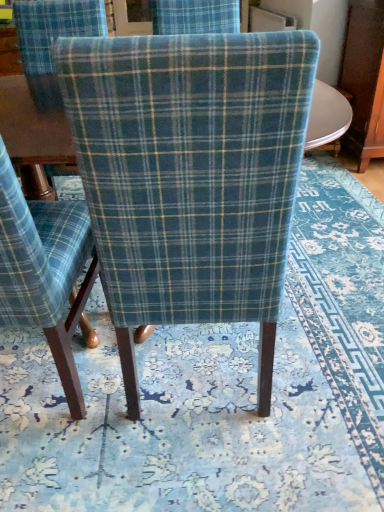
Question: From a real-world perspective, relative to blue floral rug at center, is blue plaid fabric chair at center, marked as the 1th chair in a left-to-right arrangement, vertically above or below?

Choices:
 (A) above
 (B) below

Answer: (A)

Question: Looking at their shapes, would you say blue plaid fabric chair at center, marked as the 1th chair in a left-to-right arrangement, is wider or thinner than blue floral rug at center?

Choices:
 (A) thin
 (B) wide

Answer: (A)

Question: Estimate the real-world distances between objects in this image. Which object is closer to the blue plaid fabric chair at center, the second chair when ordered from right to left?

Choices:
 (A) plaid fabric chair at center, acting as the 2th chair starting from the left
 (B) blue floral rug at center

Answer: (A)

Question: Which object is positioned closest to the plaid fabric chair at center, the first chair from the right?

Choices:
 (A) blue plaid fabric chair at center, marked as the 1th chair in a left-to-right arrangement
 (B) blue floral rug at center

Answer: (A)